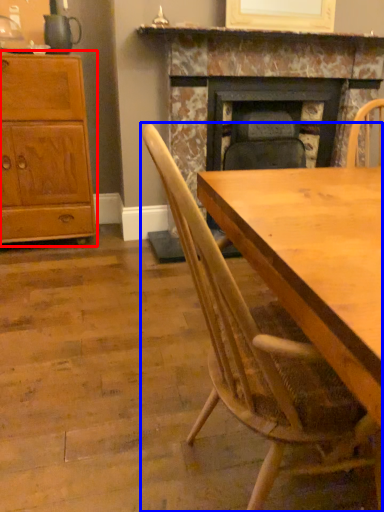
Question: Among these objects, which one is farthest to the camera, cabinetry (highlighted by a red box) or chair (highlighted by a blue box)?

Choices:
 (A) cabinetry
 (B) chair

Answer: (A)